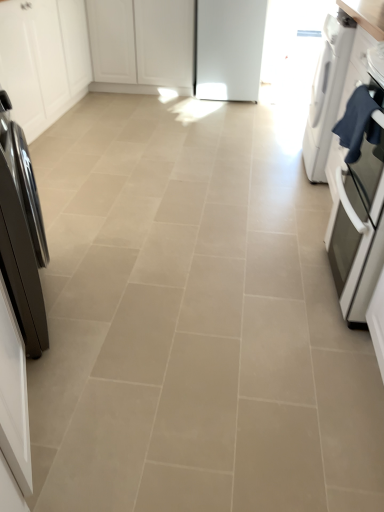
Image resolution: width=384 pixels, height=512 pixels. I want to click on free space below matte stainless steel oven at right (from a real-world perspective), so click(x=332, y=276).